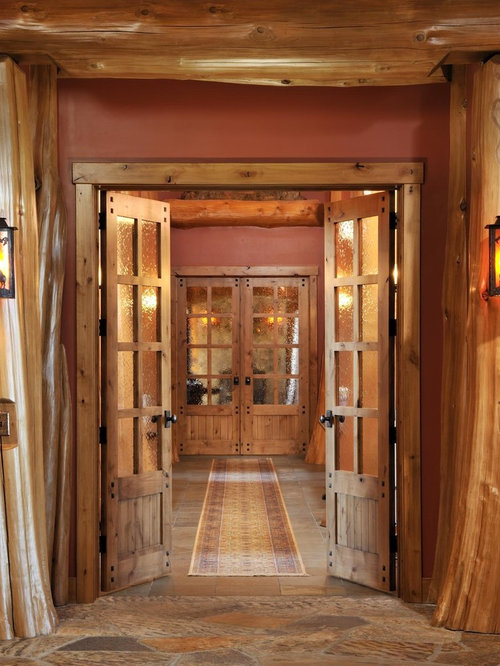
Find the location of a particular element. The image size is (500, 666). tile floor is located at coordinates (258, 587).